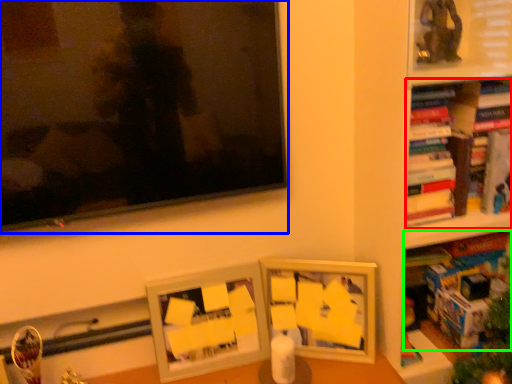
Question: Based on their relative distances, which object is farther from book (highlighted by a red box)? Choose from television (highlighted by a blue box) and book (highlighted by a green box).

Choices:
 (A) television
 (B) book

Answer: (A)